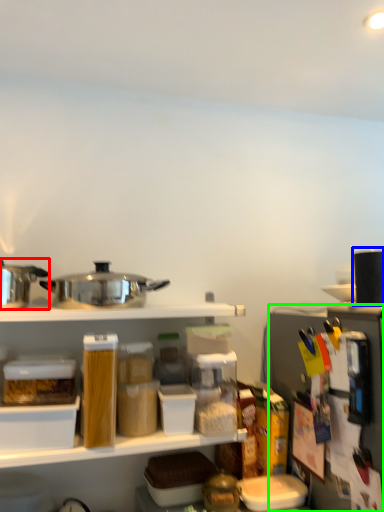
Question: Which object is positioned farthest from appliance (highlighted by a red box)? Select from appliance (highlighted by a blue box) and appliance (highlighted by a green box).

Choices:
 (A) appliance
 (B) appliance

Answer: (A)